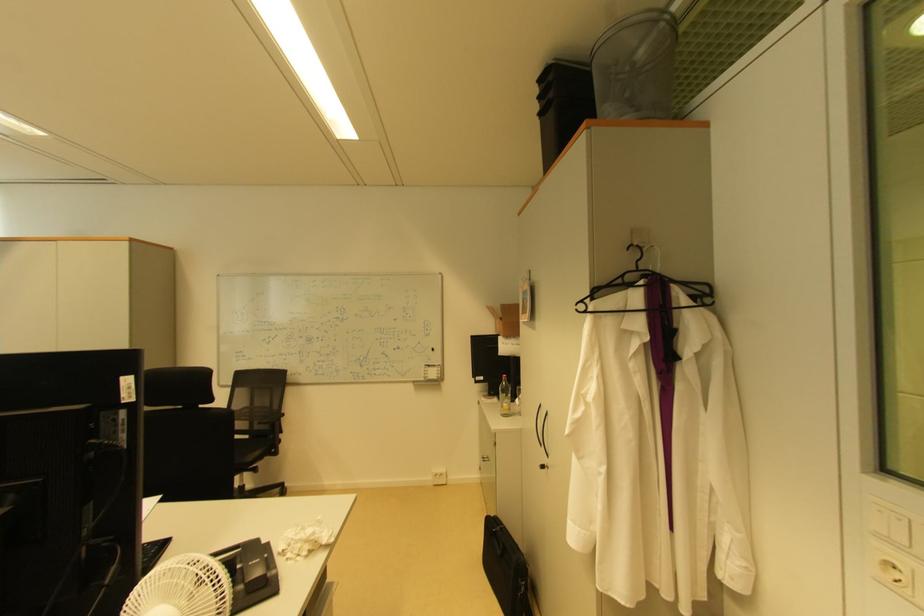
Identify the location of wire mesh basket. (636, 66).